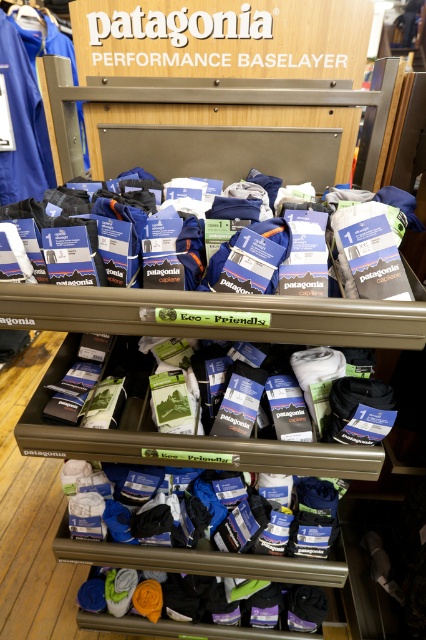
Question: Does white cotton socks at center have a smaller size compared to blue fabric baselayer at center?

Choices:
 (A) yes
 (B) no

Answer: (A)

Question: Among these points, which one is nearest to the camera?

Choices:
 (A) (345, 456)
 (B) (8, 189)
 (C) (308, 204)

Answer: (A)

Question: Where is white cotton socks at center located in relation to blue fabric baselayer at center in the image?

Choices:
 (A) above
 (B) below

Answer: (B)

Question: Is blue fabric baselayer at center below blue fabric at upper left?

Choices:
 (A) no
 (B) yes

Answer: (B)

Question: Which object is closer to the camera taking this photo?

Choices:
 (A) white cotton socks at center
 (B) blue fabric baselayer at center

Answer: (B)

Question: Based on their relative distances, which object is nearer to the blue fabric baselayer at center?

Choices:
 (A) blue fabric at upper left
 (B) white cotton socks at center

Answer: (B)